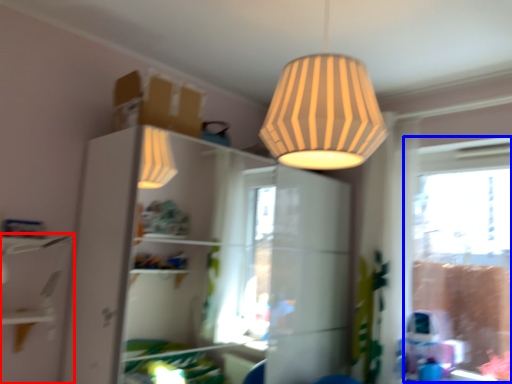
Question: Among these objects, which one is farthest to the camera, shelf (highlighted by a red box) or window frame (highlighted by a blue box)?

Choices:
 (A) shelf
 (B) window frame

Answer: (B)